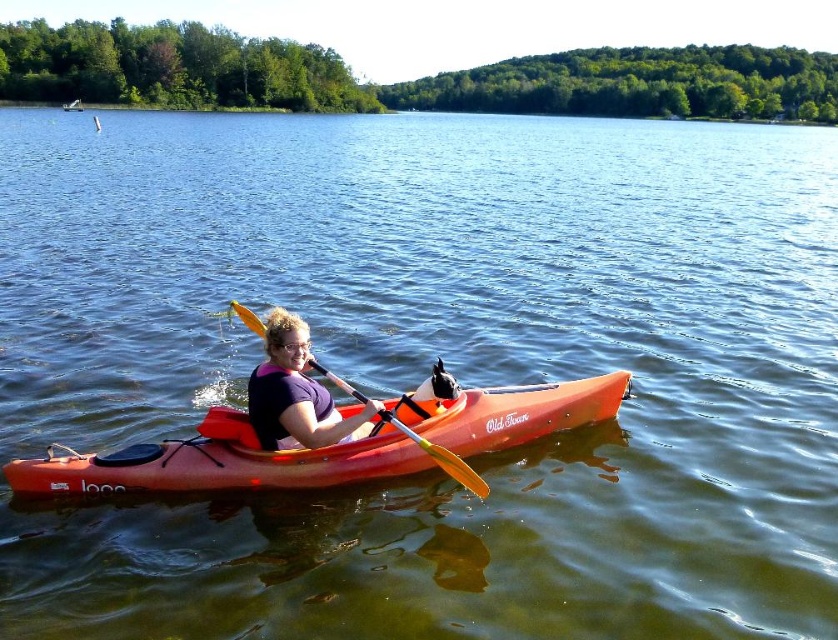
Question: Among these points, which one is nearest to the camera?

Choices:
 (A) (291, 381)
 (B) (172, 456)
 (C) (314, 397)

Answer: (A)

Question: Can you confirm if matte purple shirt at center is wider than purple fabric life jacket at center?

Choices:
 (A) yes
 (B) no

Answer: (A)

Question: Which point appears closest to the camera in this image?

Choices:
 (A) (453, 464)
 (B) (262, 438)
 (C) (282, 403)
 (D) (542, 412)

Answer: (C)

Question: Is matte purple shirt at center wider than purple fabric life jacket at center?

Choices:
 (A) yes
 (B) no

Answer: (A)

Question: Which object appears farthest from the camera in this image?

Choices:
 (A) purple fabric life jacket at center
 (B) orange matte kayak at center
 (C) yellowwoodenpaddle at center
 (D) matte purple shirt at center

Answer: (C)

Question: Is matte purple shirt at center smaller than purple fabric life jacket at center?

Choices:
 (A) yes
 (B) no

Answer: (B)